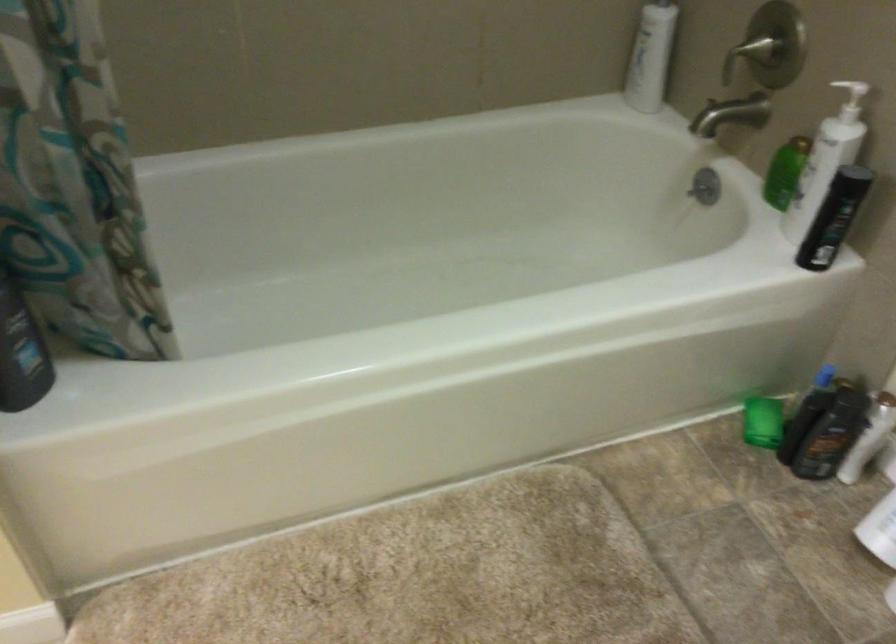
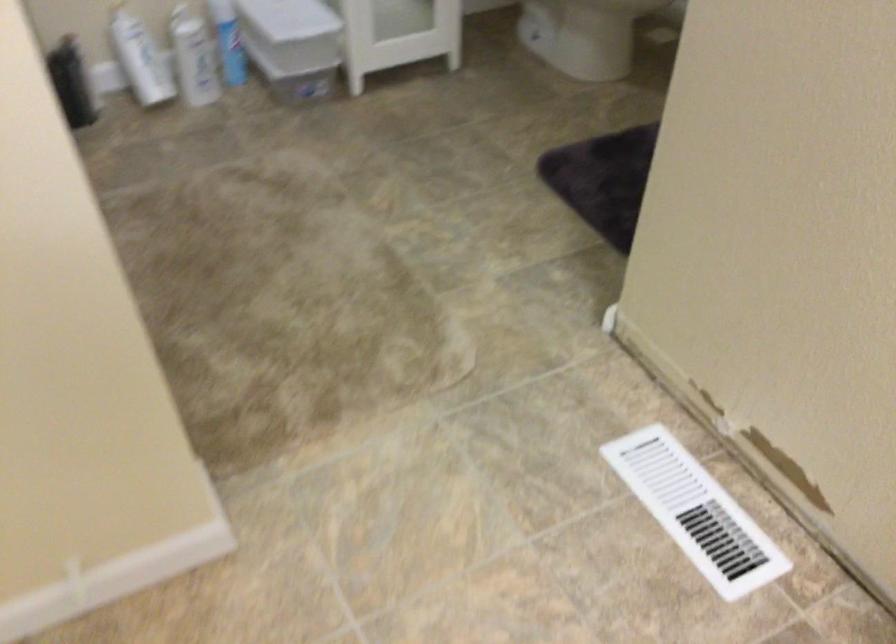
Locate, in the second image, the point that corresponds to point 786,415 in the first image.

(72, 82)